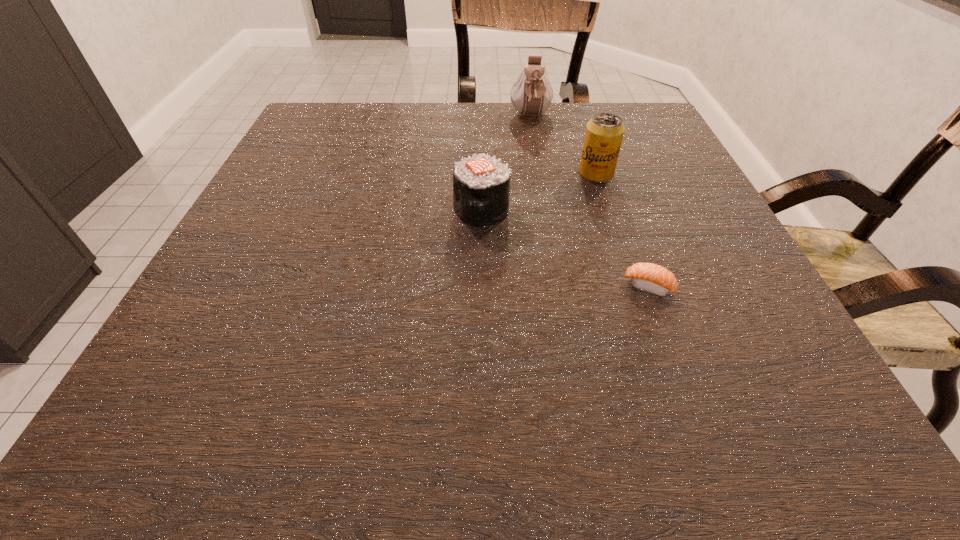
Identify the location of object that is the second closest to the nearest object. (604, 133).

I want to click on the second closest object to the left sushi, so click(x=649, y=277).

Locate an element on the screen. The height and width of the screenshot is (540, 960). free location that satisfies the following two spatial constraints: 1. on the front-facing side of the nearer sushi; 2. on the left side of the pouch is located at coordinates (560, 286).

What are the coordinates of `vacant region that satisfies the following two spatial constraints: 1. on the front-facing side of the nearer sushi; 2. on the left side of the second object from left to right` in the screenshot? It's located at point(560,286).